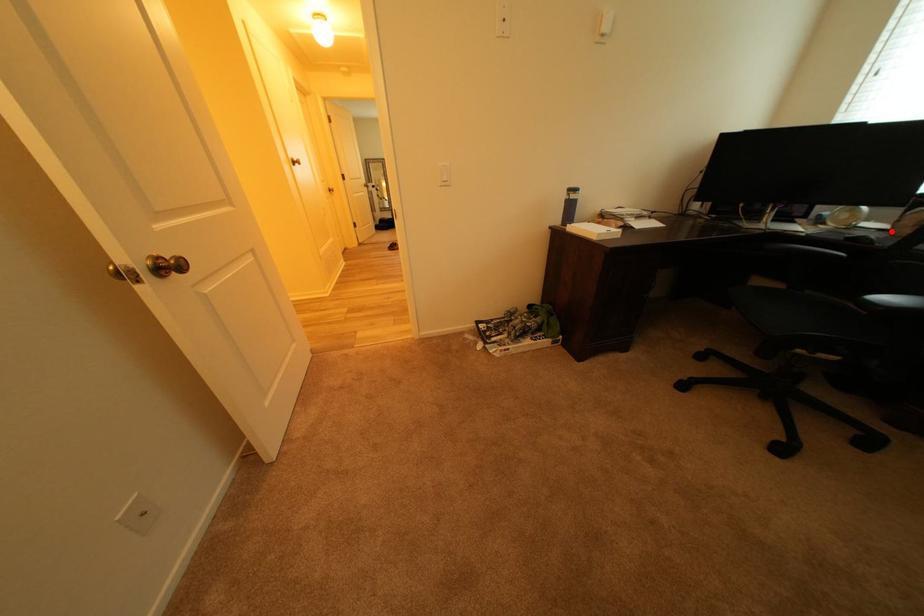
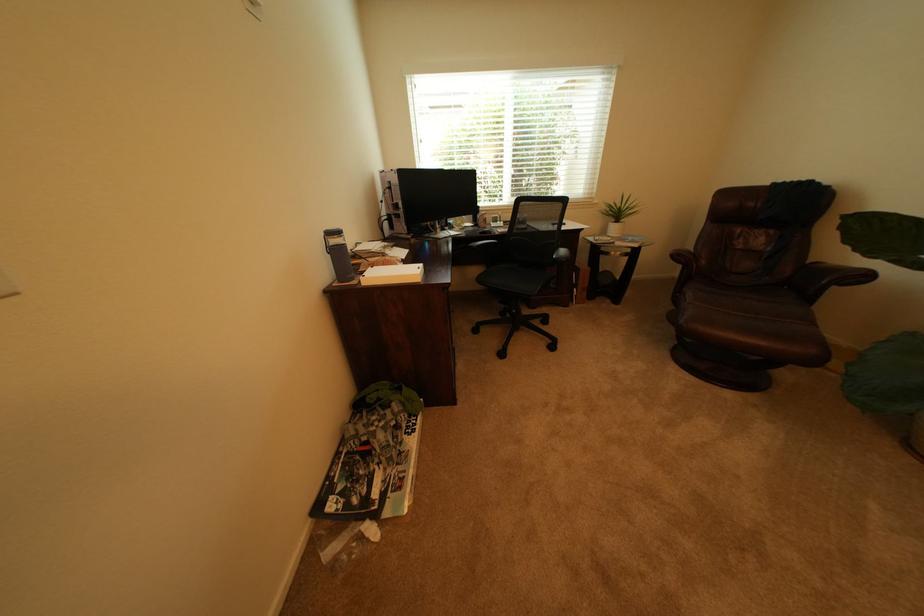
In the second image, find the point that corresponds to the highlighted location in the first image.

(482, 228)